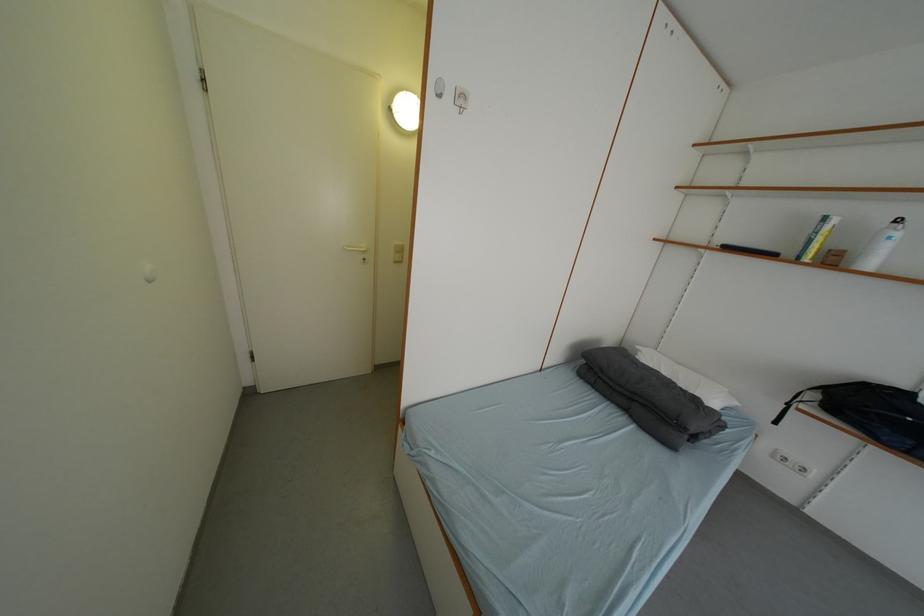
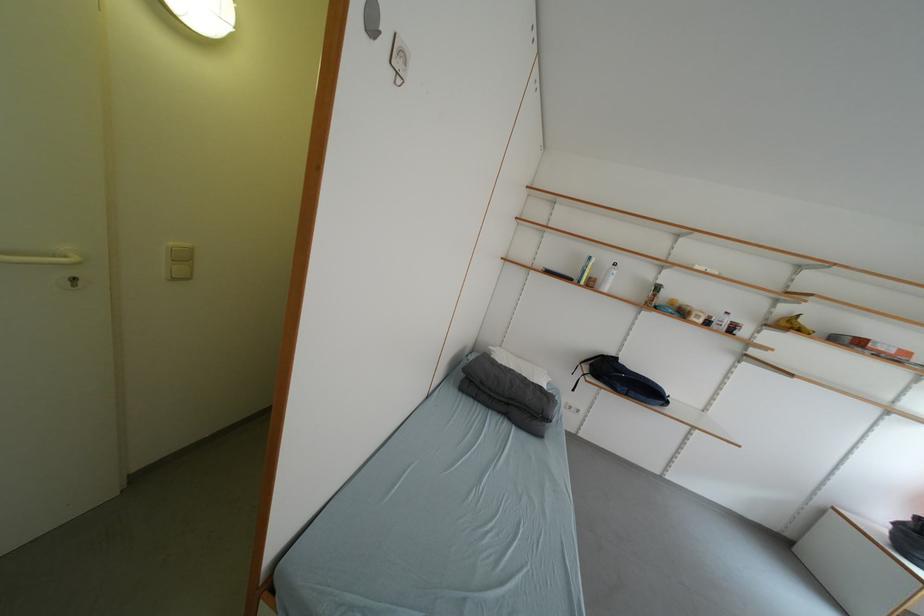
The point at (842, 264) is marked in the first image. Where is the corresponding point in the second image?

(600, 286)